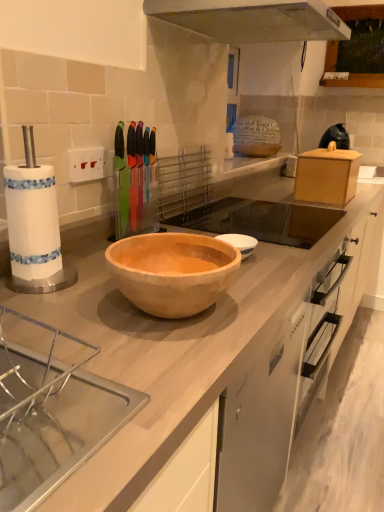
Question: From the image's perspective, is clear acrylic sink at lower left, marked as the 1th sink in a front-to-back arrangement, below wooden bowl at center, which ranks as the first sink in back-to-front order?

Choices:
 (A) no
 (B) yes

Answer: (B)

Question: From a real-world perspective, does clear acrylic sink at lower left, which is the second sink in right-to-left order, stand above wooden bowl at center, acting as the second sink starting from the bottom?

Choices:
 (A) yes
 (B) no

Answer: (A)

Question: From a real-world perspective, does clear acrylic sink at lower left, the second sink viewed from the back, sit lower than wooden bowl at center, acting as the second sink starting from the bottom?

Choices:
 (A) yes
 (B) no

Answer: (B)

Question: Is wooden bowl at center, arranged as the first sink when viewed from the top, inside clear acrylic sink at lower left, the second sink viewed from the back?

Choices:
 (A) no
 (B) yes

Answer: (A)

Question: Is wooden bowl at center, acting as the second sink starting from the bottom, at the back of clear acrylic sink at lower left, the second sink viewed from the back?

Choices:
 (A) no
 (B) yes

Answer: (A)

Question: Is point (49, 474) closer or farther from the camera than point (198, 206)?

Choices:
 (A) farther
 (B) closer

Answer: (B)

Question: Considering the positions of clear acrylic sink at lower left, which is counted as the 1th sink, starting from the bottom, and wooden bowl at center, arranged as the first sink when viewed from the top, in the image, is clear acrylic sink at lower left, which is counted as the 1th sink, starting from the bottom, bigger or smaller than wooden bowl at center, arranged as the first sink when viewed from the top,?

Choices:
 (A) big
 (B) small

Answer: (B)

Question: From a real-world perspective, is clear acrylic sink at lower left, which is the second sink in right-to-left order, physically located above or below wooden bowl at center, the 2th sink from the left?

Choices:
 (A) below
 (B) above

Answer: (B)

Question: From the image's perspective, is clear acrylic sink at lower left, which is the second sink in right-to-left order, located above or below wooden bowl at center, which ranks as the first sink in back-to-front order?

Choices:
 (A) below
 (B) above

Answer: (A)

Question: Is point (309, 234) positioned closer to the camera than point (349, 143)?

Choices:
 (A) closer
 (B) farther

Answer: (A)

Question: Is wooden bowl at center, the first sink in the right-to-left sequence, situated inside black plastic kettle at upper right or outside?

Choices:
 (A) inside
 (B) outside

Answer: (B)

Question: Is wooden bowl at center, which ranks as the first sink in back-to-front order, in front of or behind black plastic kettle at upper right in the image?

Choices:
 (A) behind
 (B) front

Answer: (B)

Question: Considering the positions of wooden bowl at center, arranged as the first sink when viewed from the top, and black plastic kettle at upper right in the image, is wooden bowl at center, arranged as the first sink when viewed from the top, wider or thinner than black plastic kettle at upper right?

Choices:
 (A) wide
 (B) thin

Answer: (A)

Question: Looking at the image, does clear acrylic sink at lower left, which is the second sink in right-to-left order, seem bigger or smaller compared to stainless steel exhaust hood at upper center?

Choices:
 (A) big
 (B) small

Answer: (B)

Question: Is clear acrylic sink at lower left, marked as the 1th sink in a front-to-back arrangement, in front of or behind stainless steel exhaust hood at upper center in the image?

Choices:
 (A) behind
 (B) front

Answer: (B)